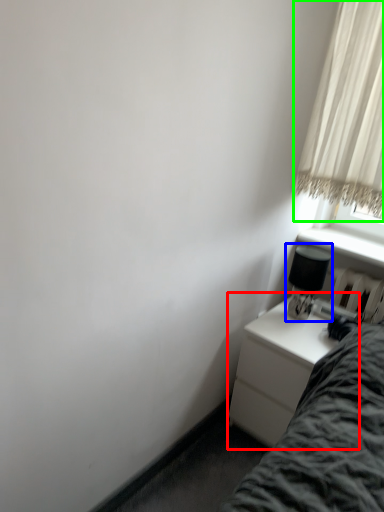
Question: Considering the real-world distances, which object is closest to nightstand (highlighted by a red box)? table lamp (highlighted by a blue box) or curtain (highlighted by a green box).

Choices:
 (A) table lamp
 (B) curtain

Answer: (A)